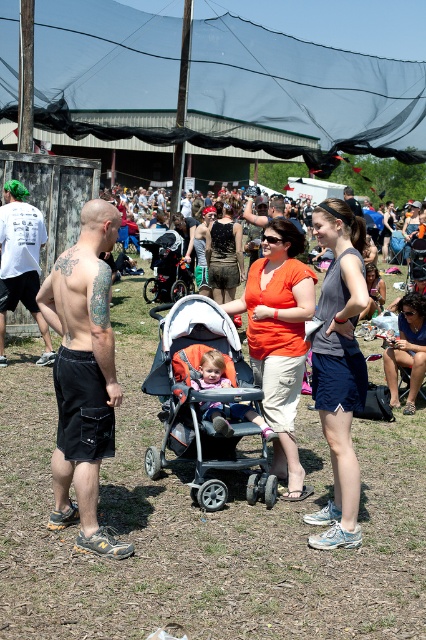
Question: Which point is farther to the camera?

Choices:
 (A) (69, 404)
 (B) (353, 196)
 (C) (227, 420)
 (D) (314, 51)

Answer: (D)

Question: Is black mesh canopy at upper center thinner than orange fabric stroller at center?

Choices:
 (A) yes
 (B) no

Answer: (B)

Question: Can you confirm if gray fabric shorts at center is positioned below white t-shirt at left?

Choices:
 (A) no
 (B) yes

Answer: (B)

Question: Does black matte shorts at left appear on the left side of matte black dress at center?

Choices:
 (A) yes
 (B) no

Answer: (A)

Question: Which object is closer to the camera taking this photo?

Choices:
 (A) matte black dress at center
 (B) white t-shirt at left

Answer: (B)

Question: Estimate the real-world distances between objects in this image. Which object is closer to the shiny silver phone at center?

Choices:
 (A) soft pink fabric stroller at center
 (B) orange matte shirt at center
 (C) black mesh canopy at upper center

Answer: (B)